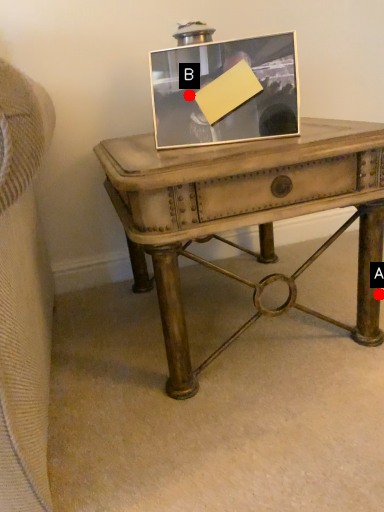
Question: Two points are circled on the image, labeled by A and B beside each circle. Which point is farther to the camera?

Choices:
 (A) A is further
 (B) B is further

Answer: (A)